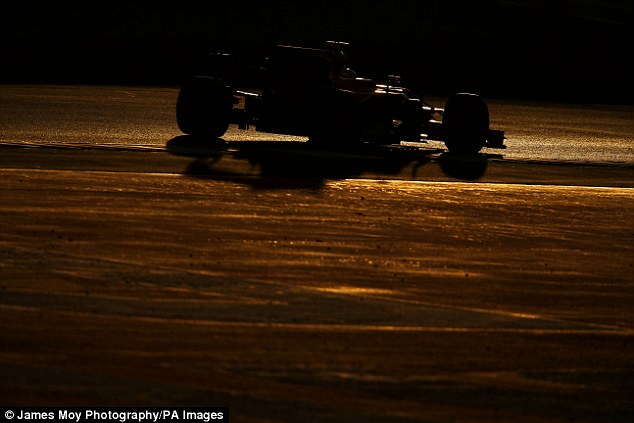
Where is `golden light on the ground`? This screenshot has height=423, width=634. golden light on the ground is located at coordinates (519, 195).